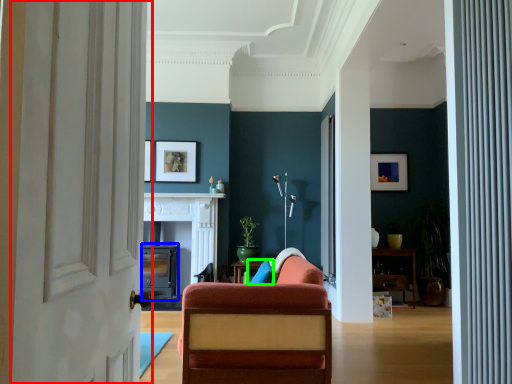
Question: Which is farther away from door (highlighted by a red box)? fireplace (highlighted by a blue box) or pillow (highlighted by a green box)?

Choices:
 (A) fireplace
 (B) pillow

Answer: (A)